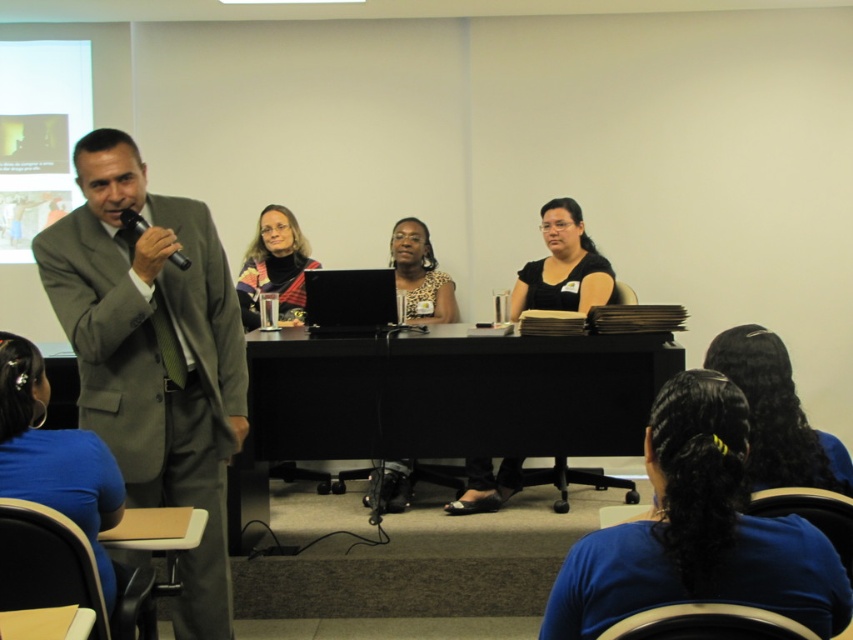
You are an attendee at this presentation. You need to locate the gray suit at left and the plaid fabric scarf at center. Which object is closer to the front of the stage?

The gray suit at left is closer to the front of the stage because it is positioned under the plaid fabric scarf at center, indicating it is in front.

You are an attendee at the presentation and want to ask a question. You notice the shiny black microphone at left and the black hair at lower right. Which object is positioned farther to the right?

The black hair at lower right is positioned to the right of the shiny black microphone at left, so it is farther to the right.

You are an attendee at this presentation and want to see both the black hair at lower right and the shiny black microphone at left clearly. Which object would you need to look down towards more?

The black hair at lower right is below the shiny black microphone at left, so you would need to look down more to see the black hair at lower right.